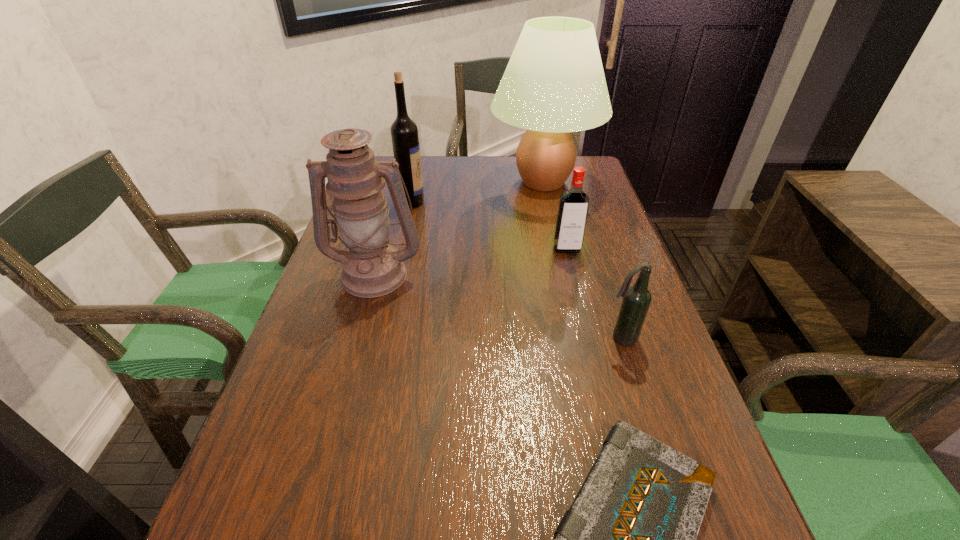
Locate an element on the screen. The width and height of the screenshot is (960, 540). free space that satisfies the following two spatial constraints: 1. on the shade of the lampshade; 2. on the back side of the second nearest object is located at coordinates (577, 338).

Where is `free spot that satisfies the following two spatial constraints: 1. on the back side of the beer bottle; 2. on the shade of the lampshade`? Image resolution: width=960 pixels, height=540 pixels. free spot that satisfies the following two spatial constraints: 1. on the back side of the beer bottle; 2. on the shade of the lampshade is located at coordinates (571, 182).